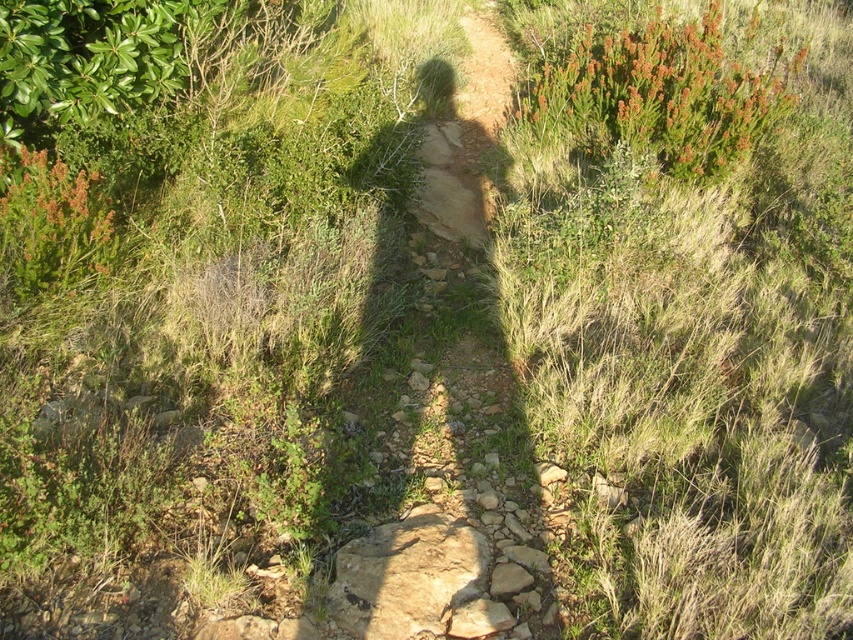
Question: Does dirt path at center have a smaller size compared to green leafy bush at upper right?

Choices:
 (A) yes
 (B) no

Answer: (A)

Question: Is dirt path at center positioned in front of green leafy bush at upper right?

Choices:
 (A) no
 (B) yes

Answer: (B)

Question: Can you confirm if dirt path at center is positioned below green leafy bush at upper right?

Choices:
 (A) yes
 (B) no

Answer: (A)